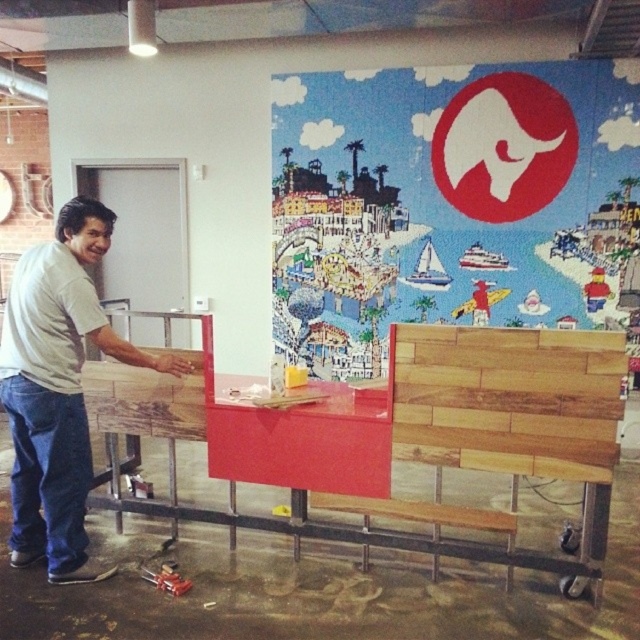
Does wooden at right have a lesser height compared to white t-shirt at left?

Yes.

Is the position of wooden at right more distant than that of white t-shirt at left?

No.

Who is more forward, (584, 412) or (51, 476)?

Positioned in front is point (584, 412).

In order to click on wooden at right in this screenshot , I will do `click(508, 400)`.